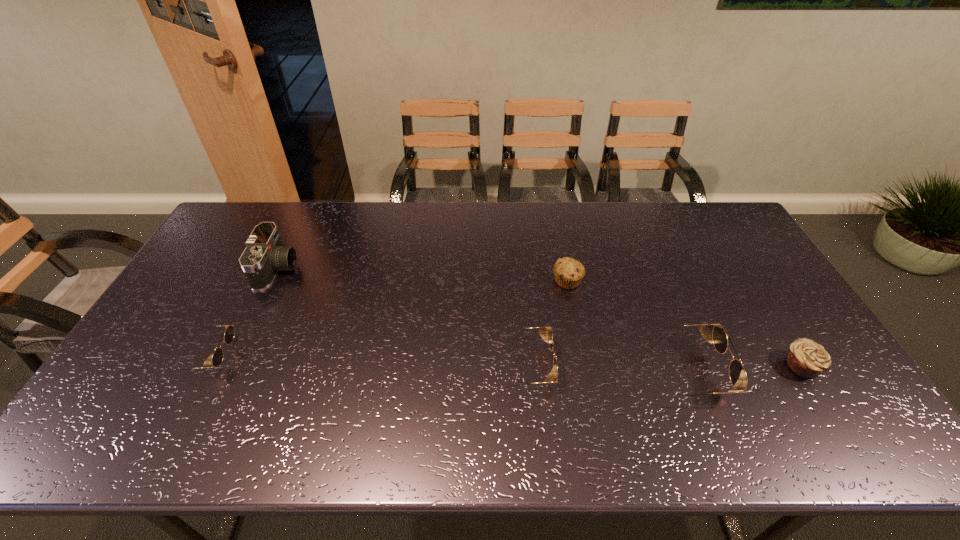
Where is `vacant space that satisfies the following two spatial constraints: 1. on the back side of the farther muffin; 2. on the front-facing side of the camera`? vacant space that satisfies the following two spatial constraints: 1. on the back side of the farther muffin; 2. on the front-facing side of the camera is located at coordinates (565, 269).

Image resolution: width=960 pixels, height=540 pixels. I want to click on vacant position in the image that satisfies the following two spatial constraints: 1. on the front-facing side of the rightmost object; 2. on the left side of the camera, so click(x=230, y=366).

You are a GUI agent. You are given a task and a screenshot of the screen. Output one action in this format:
    pyautogui.click(x=<x>, y=<y>)
    Task: Click on the vacant region that satisfies the following two spatial constraints: 1. on the back side of the left muffin; 2. on the front-facing side of the camera
    The height and width of the screenshot is (540, 960).
    Given the screenshot: What is the action you would take?
    pyautogui.click(x=565, y=269)

Image resolution: width=960 pixels, height=540 pixels. Find the location of `free location that satisfies the following two spatial constraints: 1. on the front-facing side of the camera; 2. on the right side of the nearer muffin`. free location that satisfies the following two spatial constraints: 1. on the front-facing side of the camera; 2. on the right side of the nearer muffin is located at coordinates (230, 366).

Locate an element on the screen. Image resolution: width=960 pixels, height=540 pixels. free space that satisfies the following two spatial constraints: 1. on the front-facing side of the camera; 2. on the left side of the fourth object from left to right is located at coordinates (272, 280).

Identify the location of vacant space that satisfies the following two spatial constraints: 1. on the front lenses of the shortest sunglasses; 2. on the back side of the rightmost object. (203, 366).